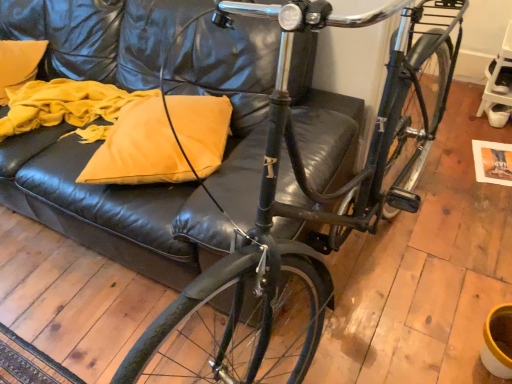
Question: From the image's perspective, relative to shiny black bicycle at center, is matte yellow pillow at center above or below?

Choices:
 (A) below
 (B) above

Answer: (B)

Question: Is matte yellow pillow at center inside or outside of shiny black bicycle at center?

Choices:
 (A) inside
 (B) outside

Answer: (B)

Question: Is matte yellow pillow at center wider or thinner than shiny black bicycle at center?

Choices:
 (A) thin
 (B) wide

Answer: (A)

Question: Is shiny black bicycle at center to the left or to the right of matte yellow pillow at center in the image?

Choices:
 (A) left
 (B) right

Answer: (B)

Question: Considering the positions of point (425, 114) and point (181, 119), is point (425, 114) closer or farther from the camera than point (181, 119)?

Choices:
 (A) farther
 (B) closer

Answer: (A)

Question: Is shiny black bicycle at center inside or outside of matte yellow pillow at center?

Choices:
 (A) outside
 (B) inside

Answer: (A)

Question: Looking at their shapes, would you say shiny black bicycle at center is wider or thinner than matte yellow pillow at center?

Choices:
 (A) wide
 (B) thin

Answer: (A)